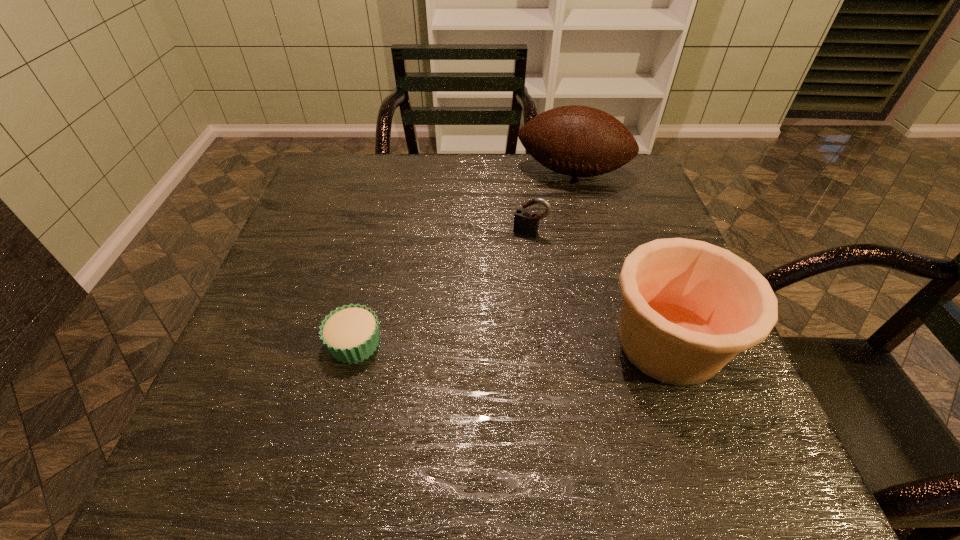
The width and height of the screenshot is (960, 540). I want to click on empty location between the third nearest object and the farthest object, so tap(551, 202).

The image size is (960, 540). Find the location of `vacant area that lies between the padlock and the pottery`. vacant area that lies between the padlock and the pottery is located at coordinates (599, 288).

Where is `empty space that is in between the second tallest object and the farthest object`? empty space that is in between the second tallest object and the farthest object is located at coordinates (620, 258).

The height and width of the screenshot is (540, 960). I want to click on free area in between the football and the second shortest object, so click(x=551, y=202).

The image size is (960, 540). I want to click on empty space that is in between the football and the shortest object, so click(x=464, y=258).

The height and width of the screenshot is (540, 960). Find the location of `free space between the padlock and the shortest object`. free space between the padlock and the shortest object is located at coordinates click(443, 288).

You are a GUI agent. You are given a task and a screenshot of the screen. Output one action in this format:
    pyautogui.click(x=<x>, y=<y>)
    Task: Click on the free space between the second tallest object and the shortest object
    The height and width of the screenshot is (540, 960).
    Given the screenshot: What is the action you would take?
    pyautogui.click(x=512, y=343)

The height and width of the screenshot is (540, 960). Identify the location of object that is the third closest to the padlock. (351, 333).

Point out which object is positioned as the nearest to the third shortest object. Please provide its 2D coordinates. Your answer should be formatted as a tuple, i.e. [(x, y)], where the tuple contains the x and y coordinates of a point satisfying the conditions above.

[(526, 221)]

This screenshot has width=960, height=540. I want to click on free space that satisfies the following two spatial constraints: 1. on the front side of the second tallest object; 2. on the left side of the padlock, so click(x=543, y=343).